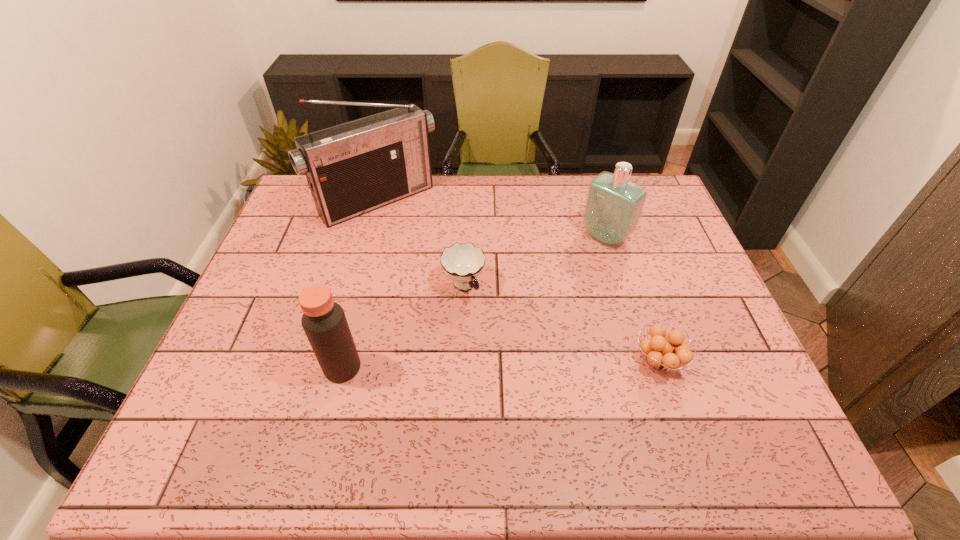
The height and width of the screenshot is (540, 960). Find the location of `vinegar`. vinegar is located at coordinates (324, 322).

Where is `orange fruit`? This screenshot has height=540, width=960. orange fruit is located at coordinates (659, 351).

Locate an element on the screen. the third object from left to right is located at coordinates (463, 263).

This screenshot has width=960, height=540. Find the location of `cup`. cup is located at coordinates (463, 263).

At what (x,y) coordinates should I click in order to perform the action: click on the tallest object. Please return your answer as a coordinate pair (x, y). This screenshot has width=960, height=540. Looking at the image, I should click on (353, 168).

I want to click on perfume, so click(x=613, y=207).

The height and width of the screenshot is (540, 960). Find the location of `vacant area situated 0.190m on the back of the vinegar`. vacant area situated 0.190m on the back of the vinegar is located at coordinates (361, 294).

Locate an element on the screen. free region located on the left of the orange fruit is located at coordinates (503, 361).

In order to click on vacant area situated 0.210m on the side of the cup with the handle in this screenshot , I will do `click(513, 363)`.

At what (x,y) coordinates should I click in order to perform the action: click on vacant point located 0.100m on the side of the cup with the handle. Please return your answer as a coordinate pair (x, y). The width and height of the screenshot is (960, 540). Looking at the image, I should click on (491, 330).